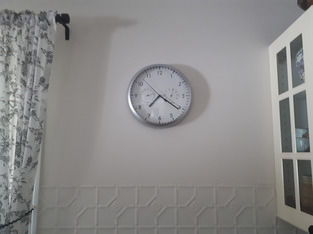
At what (x,y) coordinates should I click in order to perform the action: click on cups. Please return your answer as a coordinate pair (x, y). The height and width of the screenshot is (234, 313). Looking at the image, I should click on (302, 130), (299, 140).